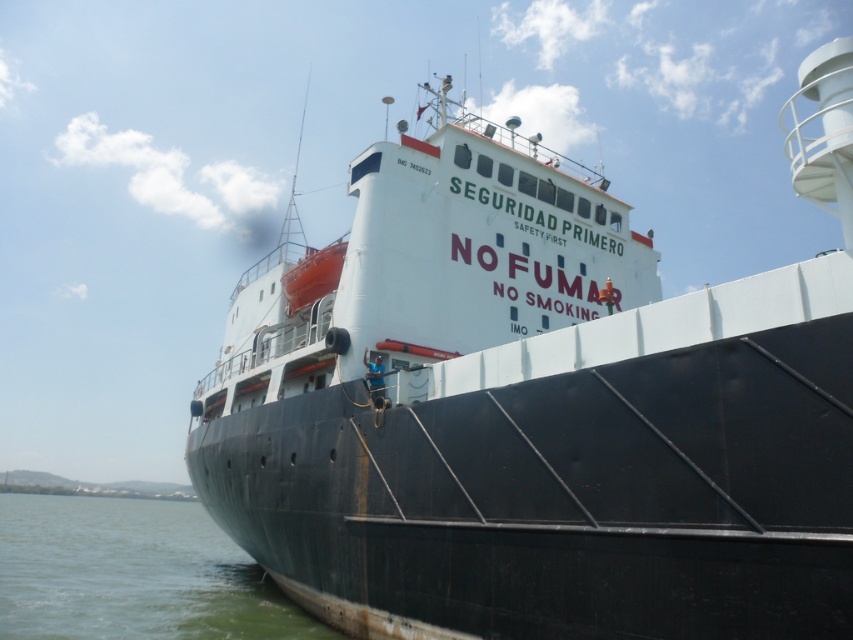
Does black matte ship at center appear under green water at lower left?

No.

Measure the distance between point (718, 307) and camera.

They are 8.49 meters apart.

Locate an element on the screen. This screenshot has height=640, width=853. black matte ship at center is located at coordinates (538, 404).